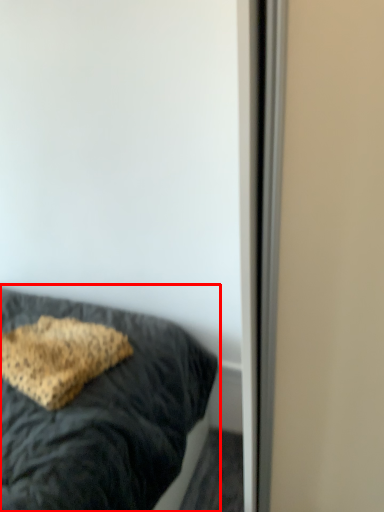
Question: From the image's perspective, where is bed (annotated by the red box) located relative to pillow?

Choices:
 (A) below
 (B) above

Answer: (A)